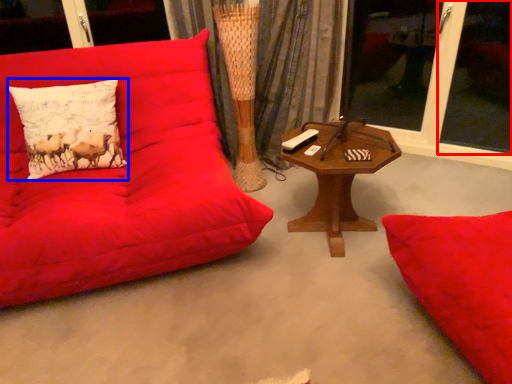
Question: Among these objects, which one is nearest to the camera, window screen (highlighted by a red box) or pillow (highlighted by a blue box)?

Choices:
 (A) window screen
 (B) pillow

Answer: (B)